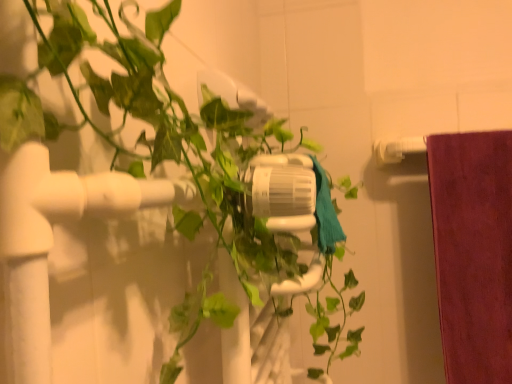
Question: In the image, is green matte plant at center on the left side or the right side of teal fabric towel at center?

Choices:
 (A) right
 (B) left

Answer: (B)

Question: In the image, is green matte plant at center positioned in front of or behind teal fabric towel at center?

Choices:
 (A) front
 (B) behind

Answer: (A)

Question: Considering the positions of point (20, 195) and point (322, 203), is point (20, 195) closer or farther from the camera than point (322, 203)?

Choices:
 (A) farther
 (B) closer

Answer: (B)

Question: Is point (335, 233) positioned closer to the camera than point (18, 188)?

Choices:
 (A) farther
 (B) closer

Answer: (A)

Question: In terms of width, does teal fabric towel at center look wider or thinner when compared to green matte plant at center?

Choices:
 (A) wide
 (B) thin

Answer: (B)

Question: Considering their positions, is teal fabric towel at center located in front of or behind green matte plant at center?

Choices:
 (A) front
 (B) behind

Answer: (B)

Question: Is teal fabric towel at center to the left or to the right of green matte plant at center in the image?

Choices:
 (A) left
 (B) right

Answer: (B)